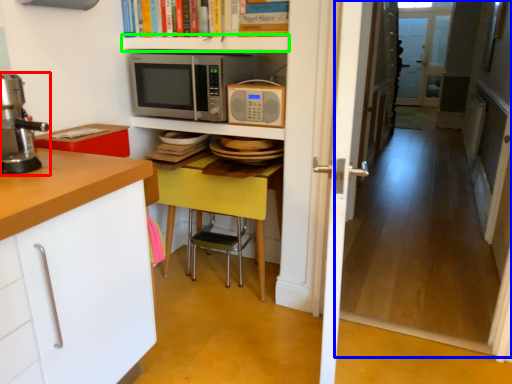
Question: Which object is positioned closest to home appliance (highlighted by a red box)? Select from corridor (highlighted by a blue box) and shelf (highlighted by a green box).

Choices:
 (A) corridor
 (B) shelf

Answer: (B)